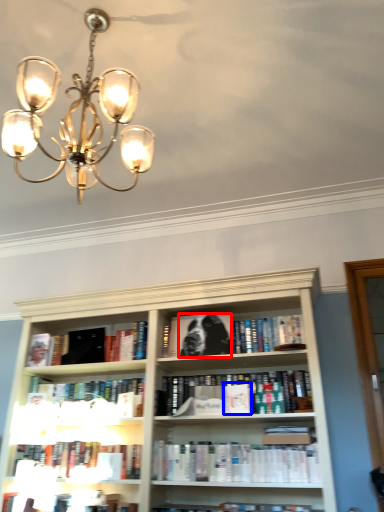
Question: Among these objects, which one is nearest to the camera, dog (highlighted by a red box) or paperback book (highlighted by a blue box)?

Choices:
 (A) dog
 (B) paperback book

Answer: (B)